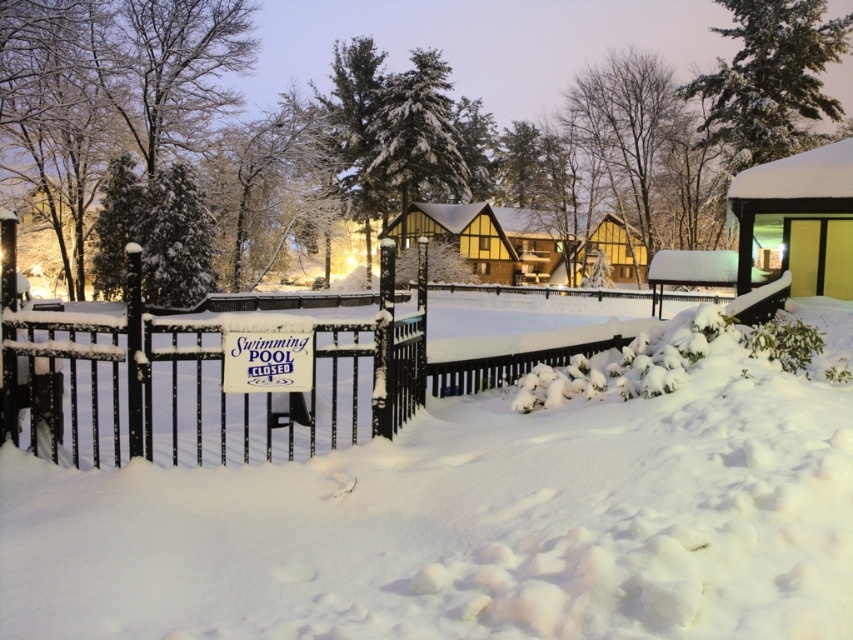
You are a delivery person trying to determine the best path to avoid the black metal fence at center and the white plastic sign at center. Which object should you move around to stay farther away from both?

Since the black metal fence at center is wider than the white plastic sign at center, you should move around the white plastic sign at center to stay farther away from both objects.

You are a delivery person trying to locate the swimming pool entrance. You see the black metal fence at center and the white plastic sign at center. According to the scene, which object is positioned higher?

The black metal fence at center is above the white plastic sign at center, so the black metal fence at center is positioned higher.

You are standing in the winter scene and want to walk from the point at coordinates point (212,388) to the point at coordinates point (252,333). Which direction should you move to get closer to your destination?

Since point (212,388) is further to the viewer than point (252,333), you should move forward to get closer to your destination.